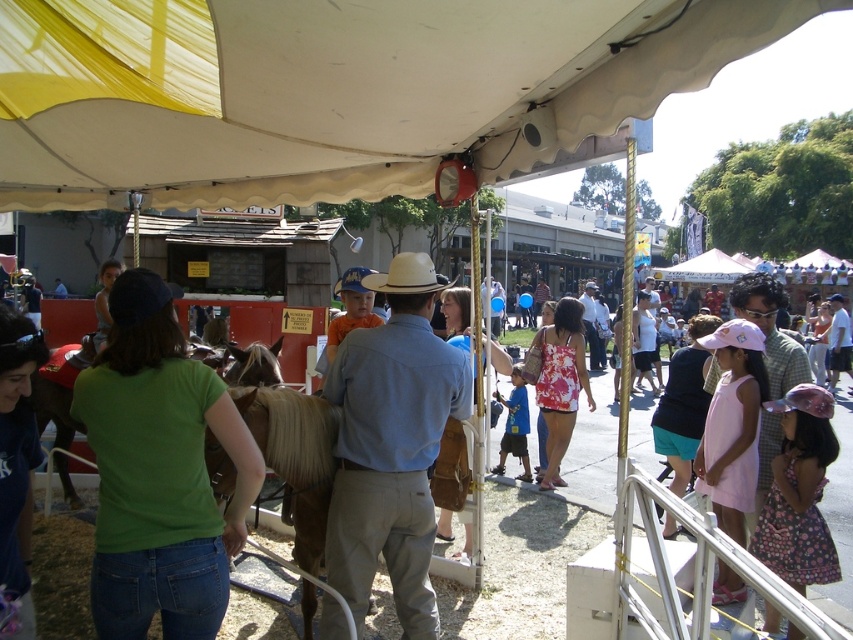
You are a photographer at the event and want to take a photo of the light brown leather cowboy hat at center and the green cotton shirt at lower left. From the photographer perspective, which object is positioned more to the left?

The green cotton shirt at lower left is positioned to the left of the light brown leather cowboy hat at center, so the green cotton shirt at lower left is more to the left.

You are organizing a photo shoot and need to ensure that the green cotton shirt at lower left and the light brown leather cowboy hat at center are both visible in the frame. Given their sizes, which object should you prioritize keeping closer to the camera to maintain detail?

The green cotton shirt at lower left should be kept closer to the camera since its width is larger than the light brown leather cowboy hat at center, ensuring both fit well within the frame.